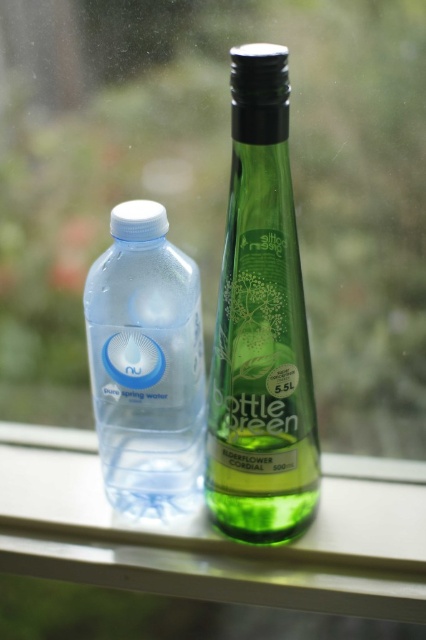
Question: Which of the following is the farthest from the observer?

Choices:
 (A) green glass bottle at center
 (B) transparent plastic bottle at left
 (C) clear plastic bottle at center

Answer: (C)

Question: Can you confirm if green glass bottle at center is smaller than transparent plastic bottle at left?

Choices:
 (A) yes
 (B) no

Answer: (B)

Question: Considering the relative positions of green glass bottle at center and transparent plastic bottle at left in the image provided, where is green glass bottle at center located with respect to transparent plastic bottle at left?

Choices:
 (A) above
 (B) below

Answer: (A)

Question: Which point appears farthest from the camera in this image?

Choices:
 (A) (14, 428)
 (B) (129, 282)
 (C) (256, 410)

Answer: (A)

Question: Is the position of green glass bottle at center less distant than that of transparent plastic bottle at left?

Choices:
 (A) no
 (B) yes

Answer: (B)

Question: Which object is positioned farthest from the clear plastic bottle at center?

Choices:
 (A) transparent plastic bottle at left
 (B) green glass bottle at center

Answer: (B)